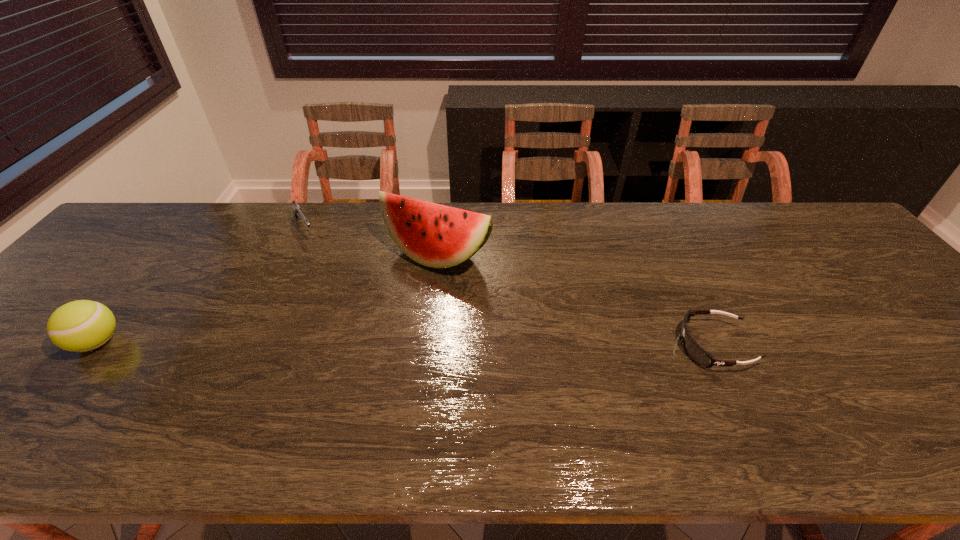
Identify the location of the second tallest object. (83, 325).

This screenshot has width=960, height=540. In order to click on the leftmost object in this screenshot , I will do (x=83, y=325).

Locate an element on the screen. The height and width of the screenshot is (540, 960). goggles is located at coordinates (692, 348).

Locate an element on the screen. Image resolution: width=960 pixels, height=540 pixels. the shortest object is located at coordinates (692, 348).

What are the coordinates of `the second object from right to left` in the screenshot? It's located at (434, 235).

The image size is (960, 540). What are the coordinates of `the tallest object` in the screenshot? It's located at (434, 235).

Find the location of a particular element. The height and width of the screenshot is (540, 960). the second shortest object is located at coordinates (297, 210).

Locate an element on the screen. The height and width of the screenshot is (540, 960). the third object from right to left is located at coordinates (297, 210).

Identify the location of free space located on the right of the leftmost object. (250, 342).

In order to click on free space located 0.170m on the front and sides of the goggles in this screenshot , I will do `click(606, 346)`.